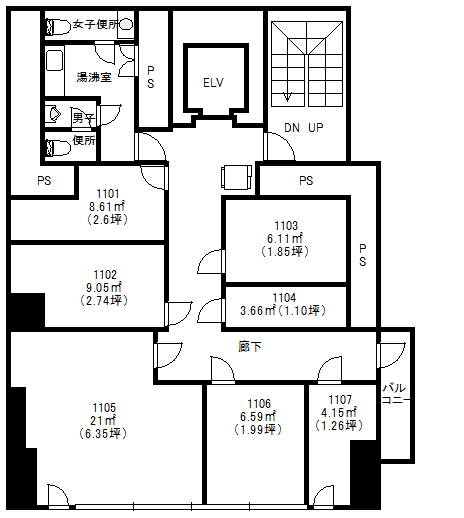
In order to click on sink in this screenshot , I will do [x=50, y=57].